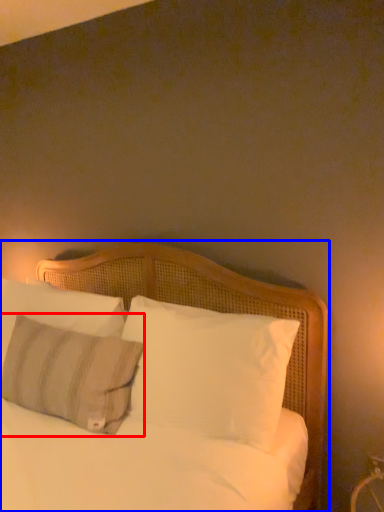
Question: Which point is further to the camera, pillow (highlighted by a red box) or bed (highlighted by a blue box)?

Choices:
 (A) pillow
 (B) bed

Answer: (A)